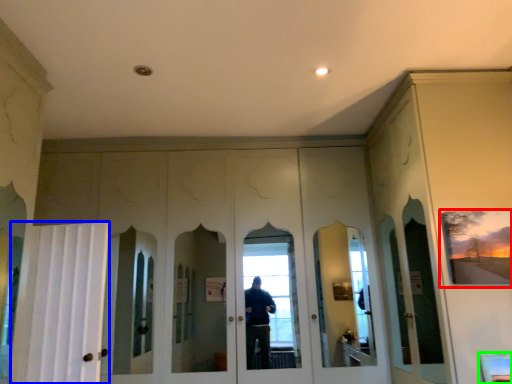
Question: Which is farther away from picture frame (highlighted by a red box)? curtain (highlighted by a blue box) or window (highlighted by a green box)?

Choices:
 (A) curtain
 (B) window

Answer: (A)